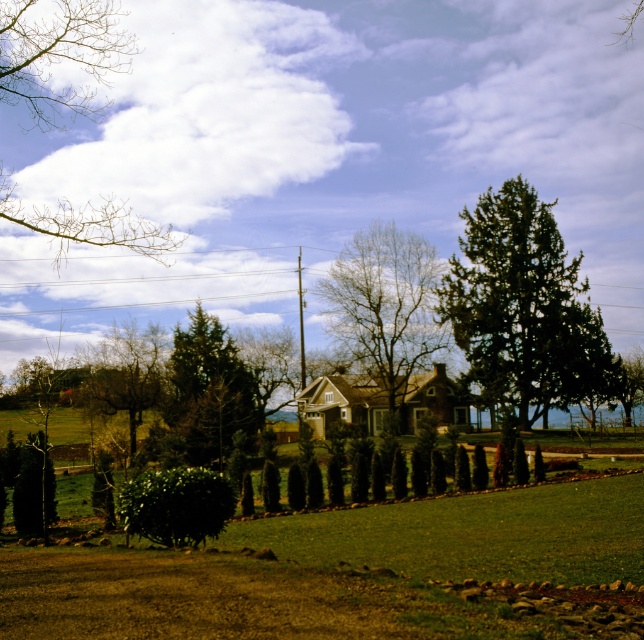
You are standing at the front gate of the house and want to walk towards the green textured tree at center. Which direction should you head?

You should head towards the center of the image, where the green textured tree at center is located at point coordinates of (526, 308).

Consider the image. You are a gardener planning to plant a new row of flowers between the green leafy tree at center and the green textured hedge at lower left. Based on their widths, which object will require more space to accommodate the flowers?

The green textured hedge at lower left is wider than the green leafy tree at center, so it will require more space to accommodate the flowers.